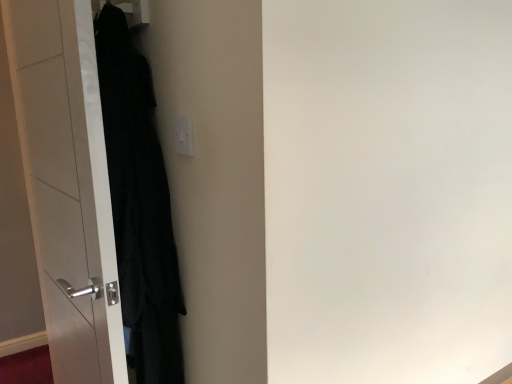
Question: Is black matte coat at left bigger than white glossy door at left?

Choices:
 (A) yes
 (B) no

Answer: (B)

Question: Is black matte coat at left at the right side of white glossy door at left?

Choices:
 (A) yes
 (B) no

Answer: (A)

Question: Is black matte coat at left behind white glossy door at left?

Choices:
 (A) yes
 (B) no

Answer: (A)

Question: Is black matte coat at left outside white glossy door at left?

Choices:
 (A) no
 (B) yes

Answer: (B)

Question: From a real-world perspective, is black matte coat at left located higher than white glossy door at left?

Choices:
 (A) no
 (B) yes

Answer: (B)

Question: Is black matte coat at left wider or thinner than white glossy door at left?

Choices:
 (A) wide
 (B) thin

Answer: (A)

Question: Looking at the image, does black matte coat at left seem bigger or smaller compared to white glossy door at left?

Choices:
 (A) small
 (B) big

Answer: (A)

Question: Would you say black matte coat at left is to the left or to the right of white glossy door at left in the picture?

Choices:
 (A) left
 (B) right

Answer: (B)

Question: From the image's perspective, relative to white glossy door at left, is black matte coat at left above or below?

Choices:
 (A) below
 (B) above

Answer: (B)

Question: Is white glossy door at left inside or outside of black matte coat at left?

Choices:
 (A) inside
 (B) outside

Answer: (B)

Question: From a real-world perspective, is white glossy door at left above or below black matte coat at left?

Choices:
 (A) above
 (B) below

Answer: (B)

Question: Considering their positions, is white glossy door at left located in front of or behind black matte coat at left?

Choices:
 (A) behind
 (B) front

Answer: (B)

Question: Considering the positions of point (48, 97) and point (165, 334), is point (48, 97) closer or farther from the camera than point (165, 334)?

Choices:
 (A) closer
 (B) farther

Answer: (A)

Question: Is white glossy door at left bigger or smaller than white plastic electric outlet at upper center?

Choices:
 (A) big
 (B) small

Answer: (A)

Question: Do you think white glossy door at left is within white plastic electric outlet at upper center, or outside of it?

Choices:
 (A) inside
 (B) outside

Answer: (B)